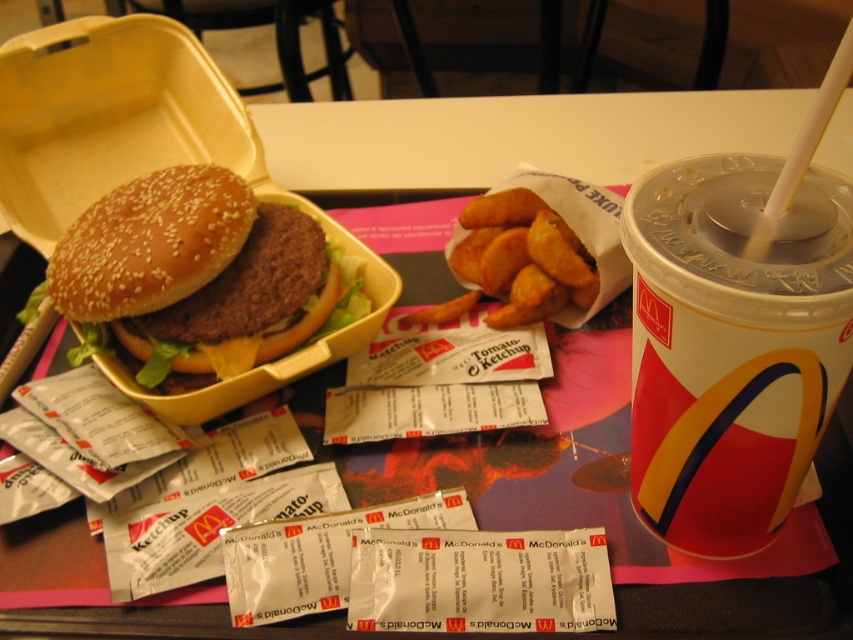
Question: Is sesame seed bun at center in front of golden crispy fries at center?

Choices:
 (A) yes
 (B) no

Answer: (A)

Question: Which point appears closest to the camera in this image?

Choices:
 (A) (x=685, y=518)
 (B) (x=135, y=227)

Answer: (A)

Question: Which point is farther from the camera taking this photo?

Choices:
 (A) (738, 236)
 (B) (575, 236)

Answer: (B)

Question: Does sesame seed bun at center have a larger size compared to golden crispy fries at center?

Choices:
 (A) yes
 (B) no

Answer: (A)

Question: Which of the following is the closest to the observer?

Choices:
 (A) golden crispy fries at center
 (B) white plastic cup at upper right

Answer: (B)

Question: Can you confirm if white plastic cup at upper right is thinner than sesame seed bun at center?

Choices:
 (A) no
 (B) yes

Answer: (B)